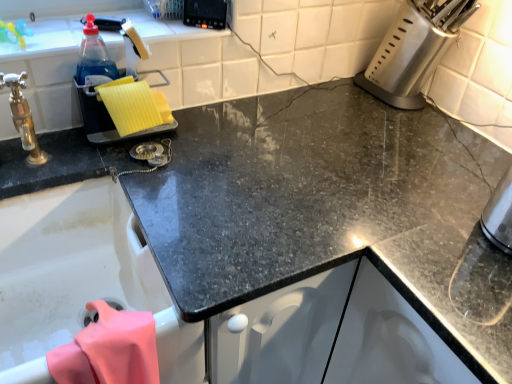
Question: Is black plastic control panel at upper center, placed as the 2th appliance when sorted from left to right, with satin silver knife block at upper right, which appears as the 3th appliance when viewed from the left?

Choices:
 (A) no
 (B) yes

Answer: (A)

Question: From a real-world perspective, is black plastic control panel at upper center, placed as the 2th appliance when sorted from left to right, on top of satin silver knife block at upper right, which appears as the 3th appliance when viewed from the left?

Choices:
 (A) no
 (B) yes

Answer: (B)

Question: Considering the relative sizes of black plastic control panel at upper center, the second appliance positioned from the right, and satin silver knife block at upper right, which appears as the 3th appliance when viewed from the left, in the image provided, is black plastic control panel at upper center, the second appliance positioned from the right, shorter than satin silver knife block at upper right, which appears as the 3th appliance when viewed from the left,?

Choices:
 (A) yes
 (B) no

Answer: (A)

Question: Is satin silver knife block at upper right, which appears as the 3th appliance when viewed from the left, at the back of black plastic control panel at upper center, placed as the 2th appliance when sorted from left to right?

Choices:
 (A) yes
 (B) no

Answer: (B)

Question: Considering the relative sizes of black plastic control panel at upper center, the second appliance positioned from the right, and satin silver knife block at upper right, the 1th appliance when ordered from right to left, in the image provided, is black plastic control panel at upper center, the second appliance positioned from the right, smaller than satin silver knife block at upper right, the 1th appliance when ordered from right to left,?

Choices:
 (A) no
 (B) yes

Answer: (B)

Question: Choose the correct answer: Is yellow sponge at left, which is the 1th appliance in left-to-right order, inside black plastic control panel at upper center, placed as the 2th appliance when sorted from left to right, or outside it?

Choices:
 (A) outside
 (B) inside

Answer: (A)

Question: Is yellow sponge at left, which is the 1th appliance in left-to-right order, wider or thinner than black plastic control panel at upper center, placed as the 2th appliance when sorted from left to right?

Choices:
 (A) wide
 (B) thin

Answer: (A)

Question: From a real-world perspective, is yellow sponge at left, which is the 1th appliance in left-to-right order, physically located above or below black plastic control panel at upper center, the second appliance positioned from the right?

Choices:
 (A) below
 (B) above

Answer: (A)

Question: From the image's perspective, relative to black plastic control panel at upper center, placed as the 2th appliance when sorted from left to right, is yellow sponge at left, marked as the third appliance in a right-to-left arrangement, above or below?

Choices:
 (A) above
 (B) below

Answer: (B)

Question: Based on their sizes in the image, would you say black plastic control panel at upper center, the second appliance positioned from the right, is bigger or smaller than satin silver knife block at upper right, the 1th appliance when ordered from right to left?

Choices:
 (A) big
 (B) small

Answer: (B)

Question: From a real-world perspective, is black plastic control panel at upper center, the second appliance positioned from the right, physically located above or below satin silver knife block at upper right, the 1th appliance when ordered from right to left?

Choices:
 (A) below
 (B) above

Answer: (B)

Question: Does point (195, 3) appear closer or farther from the camera than point (429, 26)?

Choices:
 (A) farther
 (B) closer

Answer: (B)

Question: From the image's perspective, relative to satin silver knife block at upper right, which appears as the 3th appliance when viewed from the left, is black plastic control panel at upper center, the second appliance positioned from the right, above or below?

Choices:
 (A) below
 (B) above

Answer: (B)

Question: Considering the positions of satin silver knife block at upper right, which appears as the 3th appliance when viewed from the left, and black plastic control panel at upper center, placed as the 2th appliance when sorted from left to right, in the image, is satin silver knife block at upper right, which appears as the 3th appliance when viewed from the left, wider or thinner than black plastic control panel at upper center, placed as the 2th appliance when sorted from left to right,?

Choices:
 (A) wide
 (B) thin

Answer: (A)

Question: From a real-world perspective, relative to black plastic control panel at upper center, placed as the 2th appliance when sorted from left to right, is satin silver knife block at upper right, the 1th appliance when ordered from right to left, vertically above or below?

Choices:
 (A) below
 (B) above

Answer: (A)